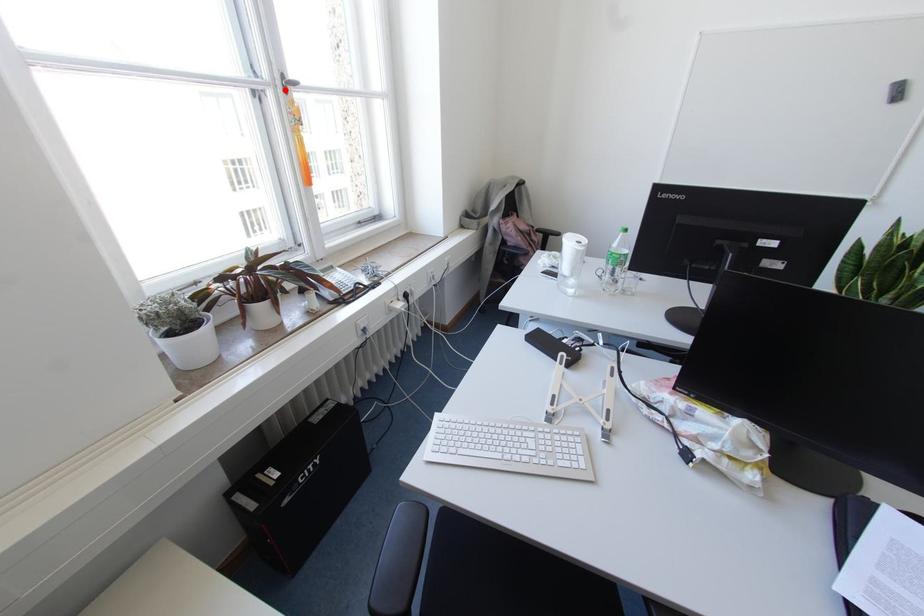
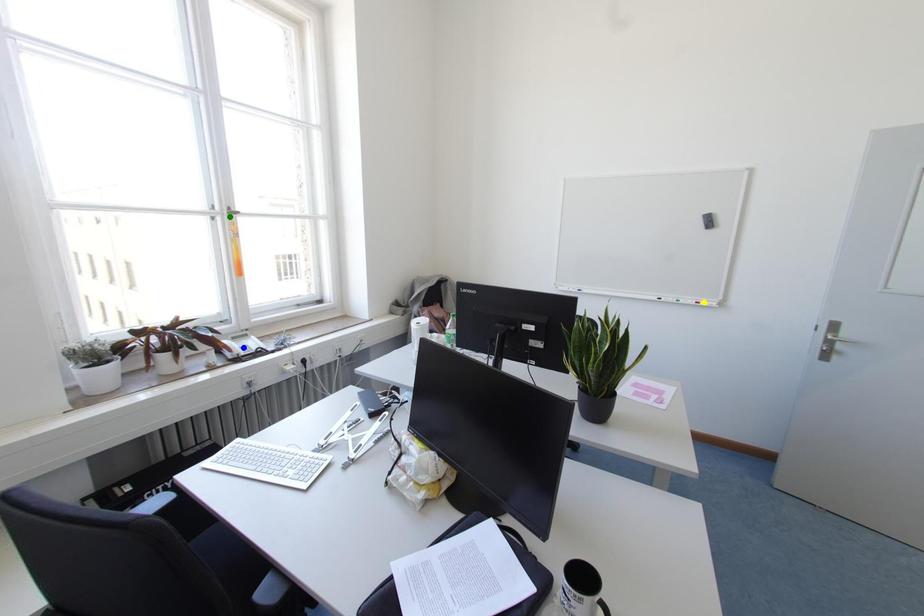
Question: I am providing you with two images of the same scene from different viewpoints. A red point is marked on the first image. You are given multiple points on the second image. Which point in image 2 is actually the same real-world point as the red point in image 1?

Choices:
 (A) yellow point
 (B) green point
 (C) blue point

Answer: (B)